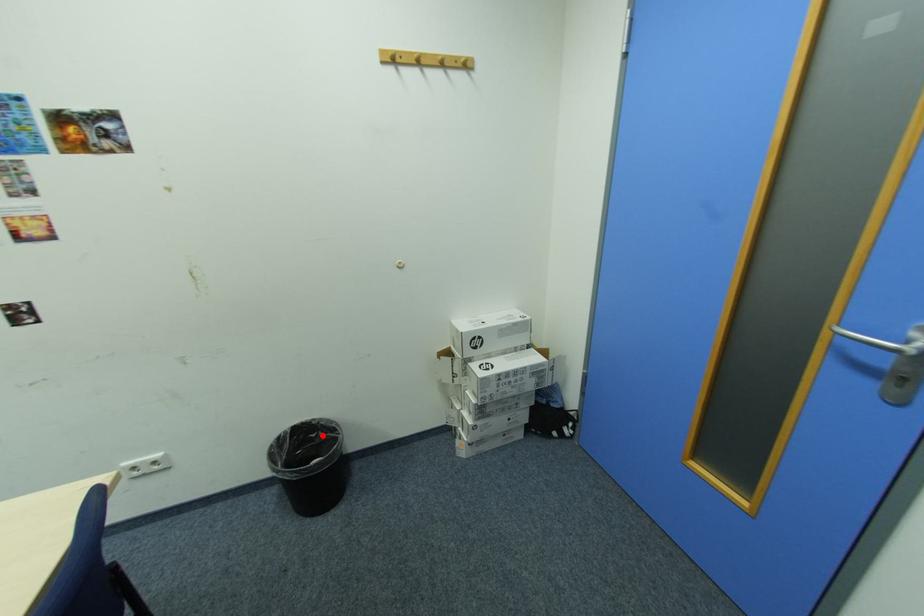
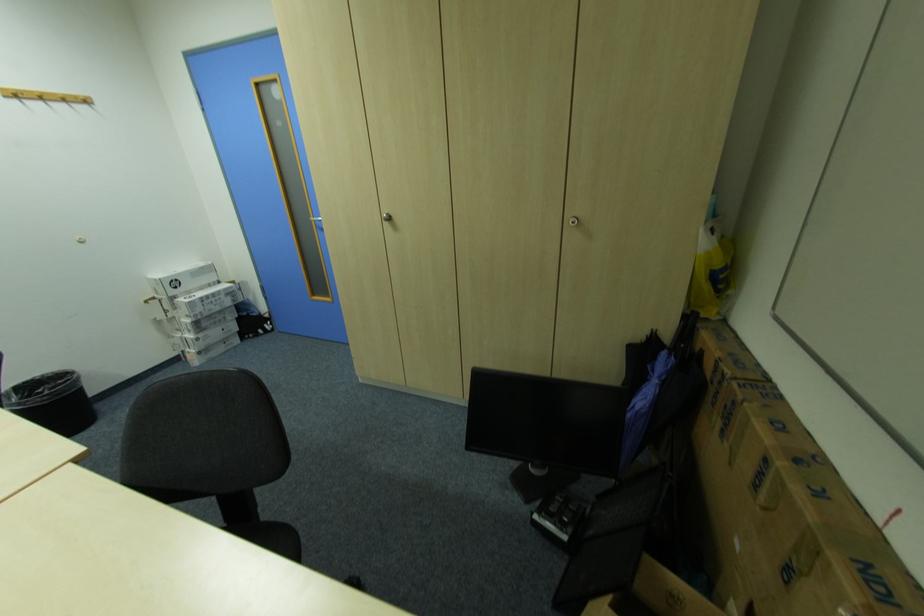
Question: A red point is marked in image1. In image2, is the corresponding 3D point closer to the camera or farther? Reply with the corresponding letter.

Choices:
 (A) The corresponding 3D point is closer.
 (B) The corresponding 3D point is farther.

Answer: (B)